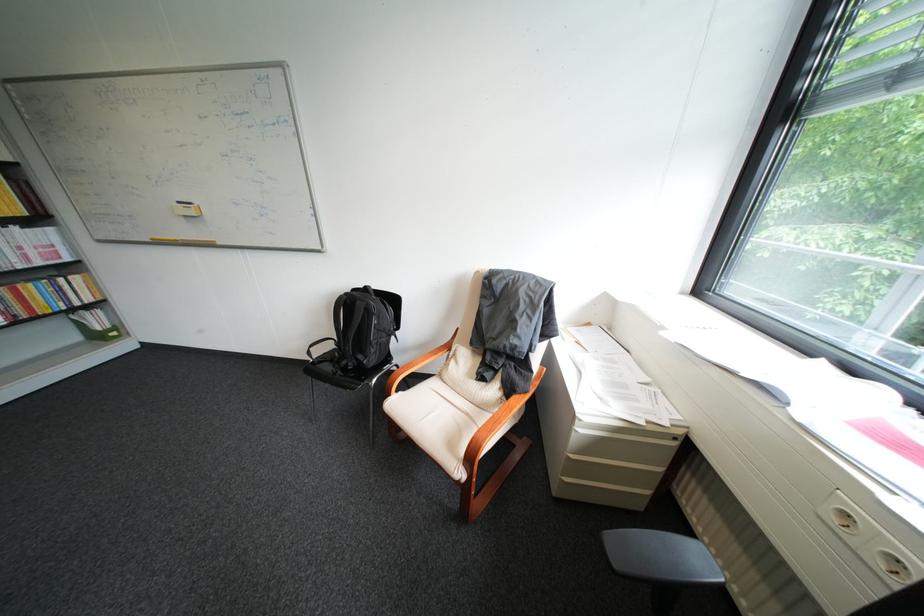
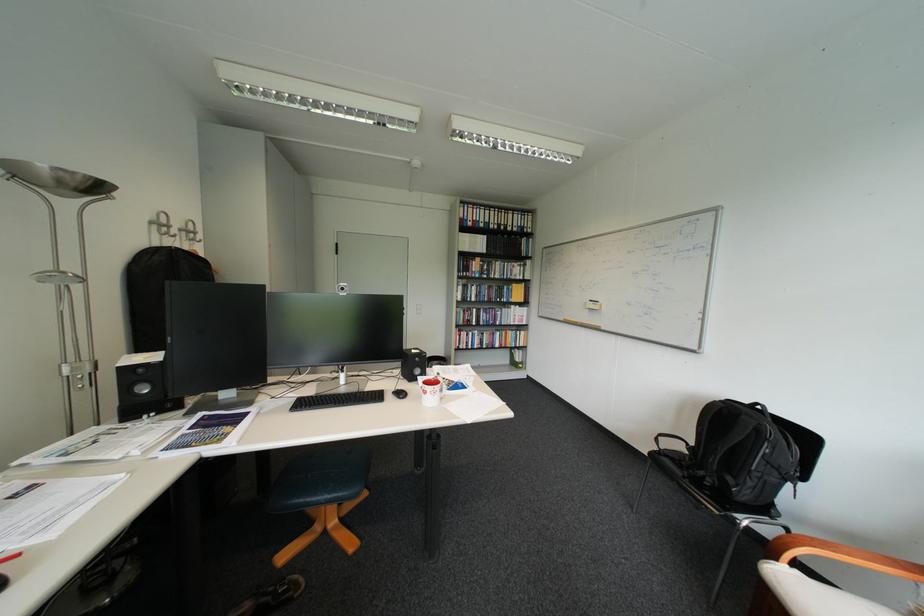
Question: How did the camera likely rotate?

Choices:
 (A) Left
 (B) Right
 (C) Up
 (D) Down

Answer: (A)